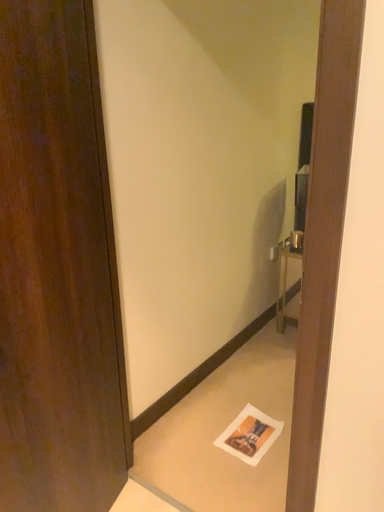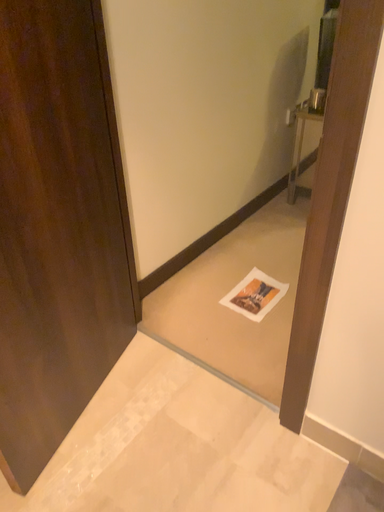
Question: Which way did the camera rotate in the video?

Choices:
 (A) rotated downward
 (B) rotated upward

Answer: (A)